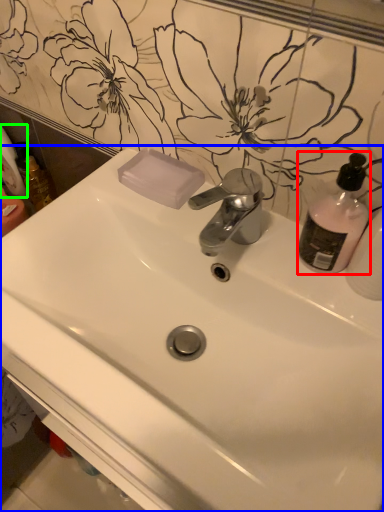
Question: Estimate the real-world distances between objects in this image. Which object is closer to cleaning product (highlighted by a red box), sink (highlighted by a blue box) or toilet paper (highlighted by a green box)?

Choices:
 (A) sink
 (B) toilet paper

Answer: (A)